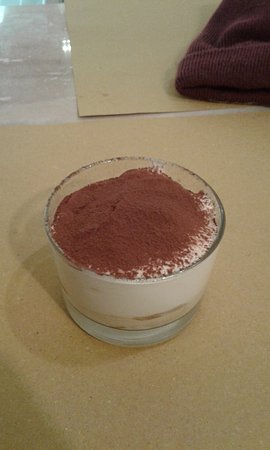
Where is `dark corner`? dark corner is located at coordinates pos(21,426).